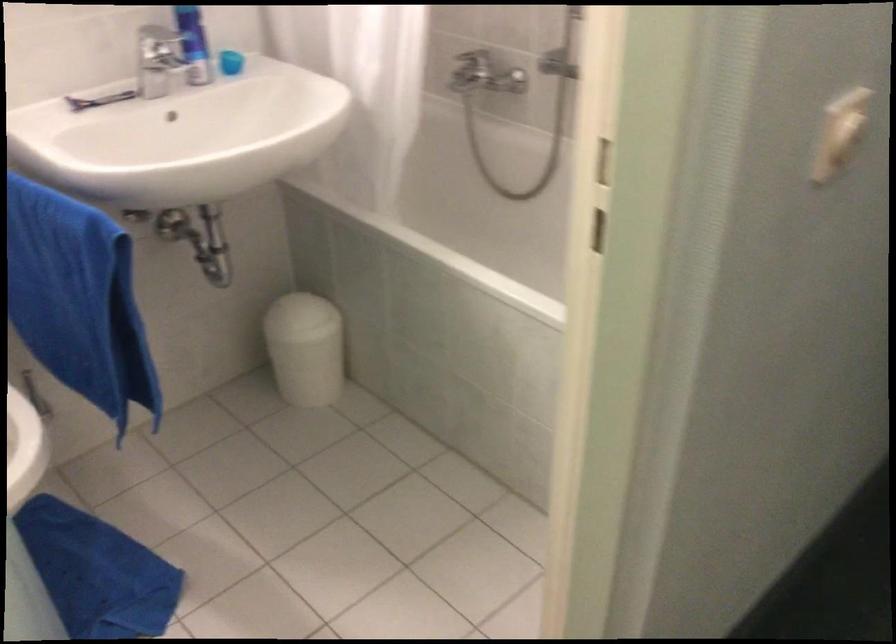
Locate an element on the screen. This screenshot has width=896, height=644. bathtub faucet handle is located at coordinates (485, 75).